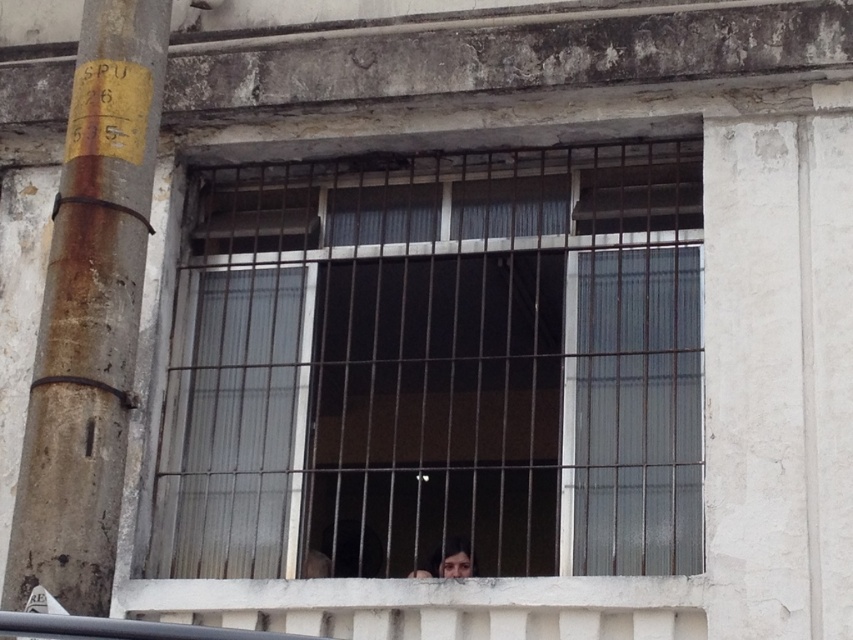
Between clear glass window at center and smooth skin face at center, which one has more height?

Standing taller between the two is clear glass window at center.

Is point (340, 432) farther from camera compared to point (456, 577)?

Yes, it is behind point (456, 577).

Which is in front, point (677, 291) or point (432, 563)?

Positioned in front is point (677, 291).

Locate an element on the screen. This screenshot has height=640, width=853. clear glass window at center is located at coordinates (437, 365).

Based on the photo, can you confirm if clear glass window at center is positioned to the left of rusty metal pole at left?

Incorrect, clear glass window at center is not on the left side of rusty metal pole at left.

Between clear glass window at center and rusty metal pole at left, which one is positioned higher?

rusty metal pole at left is higher up.

Is point (631, 147) behind point (141, 161)?

Yes, point (631, 147) is farther from viewer.

This screenshot has height=640, width=853. Find the location of `clear glass window at center`. clear glass window at center is located at coordinates (437, 365).

Is rusty metal pole at left thinner than smooth skin face at center?

In fact, rusty metal pole at left might be wider than smooth skin face at center.

Does point (109, 248) lie behind point (428, 556)?

No, (109, 248) is closer to viewer.

This screenshot has width=853, height=640. What do you see at coordinates (90, 314) in the screenshot?
I see `rusty metal pole at left` at bounding box center [90, 314].

Identify the location of rusty metal pole at left. This screenshot has height=640, width=853. (90, 314).